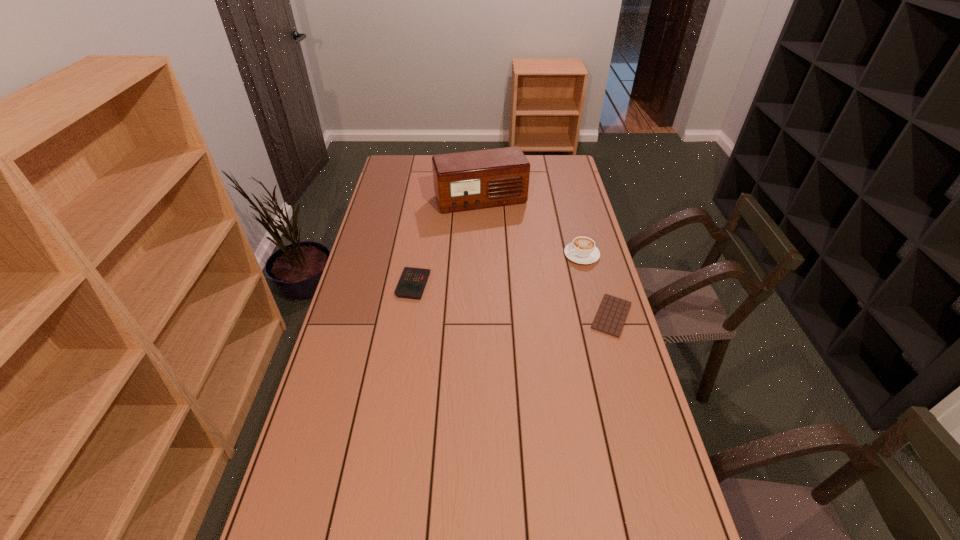
Locate an element on the screen. The height and width of the screenshot is (540, 960). the third tallest object is located at coordinates (411, 285).

Find the location of a particular element. The height and width of the screenshot is (540, 960). the shortest object is located at coordinates (610, 318).

At what (x,y) coordinates should I click in order to perform the action: click on cappuccino. Please return your answer as a coordinate pair (x, y). Looking at the image, I should click on (582, 250).

The image size is (960, 540). In order to click on the third nearest object in this screenshot , I will do `click(582, 250)`.

Where is `the tallest object`? This screenshot has height=540, width=960. the tallest object is located at coordinates (463, 181).

What are the coordinates of `the farthest object` in the screenshot? It's located at (463, 181).

The height and width of the screenshot is (540, 960). In order to click on vacant point located 0.080m on the front of the third tallest object in this screenshot , I will do `click(408, 318)`.

Locate an element on the screen. The width and height of the screenshot is (960, 540). blank space located 0.360m on the back of the shortest object is located at coordinates (588, 233).

Find the location of a particular element. This screenshot has width=960, height=540. blank space located 0.320m on the side of the second tallest object with the handle is located at coordinates click(494, 289).

Locate an element on the screen. The image size is (960, 540). free region located 0.340m on the side of the second tallest object with the handle is located at coordinates (490, 291).